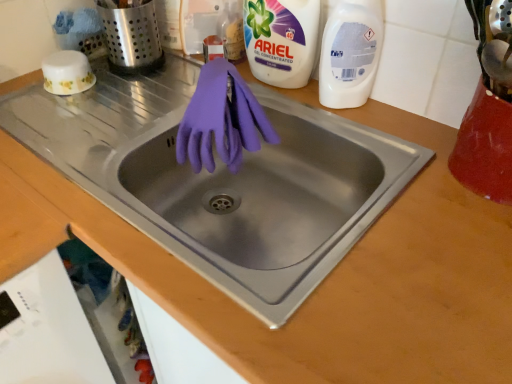
Where is `white gel concentrated at upper right, arranged as the 2th cleaning product when viewed from the right`? The height and width of the screenshot is (384, 512). white gel concentrated at upper right, arranged as the 2th cleaning product when viewed from the right is located at coordinates (281, 40).

Describe the element at coordinates (131, 35) in the screenshot. I see `brushed metal utensil holder at upper left` at that location.

The image size is (512, 384). In order to click on white plastic bottle at upper right, marked as the first cleaning product in a right-to-left arrangement in this screenshot , I will do `click(350, 53)`.

The height and width of the screenshot is (384, 512). What do you see at coordinates (256, 195) in the screenshot?
I see `matte purple gloves at center` at bounding box center [256, 195].

The width and height of the screenshot is (512, 384). In order to click on white plastic dishwasher at lower left in this screenshot , I will do `click(49, 330)`.

In order to face purple rubber gloves at center, should I rotate leftwards or rightwards?

To align with it, rotate left about 3.256°.

This screenshot has width=512, height=384. In order to click on white gel concentrated at upper right, which ranks as the first cleaning product in left-to-right order in this screenshot , I will do `click(281, 40)`.

Visually, is matte purple gloves at center positioned to the left or to the right of white gel concentrated at upper right, arranged as the 2th cleaning product when viewed from the right?

Based on their positions, matte purple gloves at center is located to the left of white gel concentrated at upper right, arranged as the 2th cleaning product when viewed from the right.

Where is `the 2nd cleaning product above when counting from the matte purple gloves at center (from the image's perspective)`? the 2nd cleaning product above when counting from the matte purple gloves at center (from the image's perspective) is located at coordinates (281, 40).

Is matte purple gloves at center facing away from white gel concentrated at upper right, arranged as the 2th cleaning product when viewed from the right?

No, matte purple gloves at center is not facing the opposite direction of white gel concentrated at upper right, arranged as the 2th cleaning product when viewed from the right.

Is white plastic bottle at upper right, which is the second cleaning product from left to right, far away from matte purple gloves at center?

No, there isn't a large distance between white plastic bottle at upper right, which is the second cleaning product from left to right, and matte purple gloves at center.

From a real-world perspective, does white plastic bottle at upper right, which is the second cleaning product from left to right, sit lower than matte purple gloves at center?

No.

Is white plastic bottle at upper right, marked as the first cleaning product in a right-to-left arrangement, oriented away from matte purple gloves at center?

white plastic bottle at upper right, marked as the first cleaning product in a right-to-left arrangement, is not turned away from matte purple gloves at center.

Considering the positions of point (77, 381) and point (357, 79), is point (77, 381) closer or farther from the camera than point (357, 79)?

Point (77, 381) is positioned closer to the camera compared to point (357, 79).

Is white plastic dishwasher at lower left to the left of white plastic bottle at upper right, marked as the first cleaning product in a right-to-left arrangement, from the viewer's perspective?

Correct, you'll find white plastic dishwasher at lower left to the left of white plastic bottle at upper right, marked as the first cleaning product in a right-to-left arrangement.

From a real-world perspective, is white plastic dishwasher at lower left physically located above or below white plastic bottle at upper right, which is the second cleaning product from left to right?

From a real-world perspective, white plastic dishwasher at lower left is physically below white plastic bottle at upper right, which is the second cleaning product from left to right.

Between white plastic dishwasher at lower left and white plastic bottle at upper right, marked as the first cleaning product in a right-to-left arrangement, which one has larger width?

white plastic dishwasher at lower left.

From a real-world perspective, who is located lower, purple rubber gloves at center or matte purple gloves at center?

matte purple gloves at center is physically lower.

Which of these two, purple rubber gloves at center or matte purple gloves at center, is smaller?

Smaller between the two is purple rubber gloves at center.

Does purple rubber gloves at center touch matte purple gloves at center?

No, purple rubber gloves at center is not beside matte purple gloves at center.

Considering the relative positions of matte purple gloves at center and brushed metal utensil holder at upper left in the image provided, is matte purple gloves at center behind brushed metal utensil holder at upper left?

No, matte purple gloves at center is closer to the camera.

Is matte purple gloves at center with brushed metal utensil holder at upper left?

No, matte purple gloves at center is not beside brushed metal utensil holder at upper left.

Between matte purple gloves at center and brushed metal utensil holder at upper left, which one appears on the left side from the viewer's perspective?

Positioned to the left is brushed metal utensil holder at upper left.

At what (x,y) coordinates should I click in order to perform the action: click on sink on the right side of brushed metal utensil holder at upper left. Please return your answer as a coordinate pair (x, y). Looking at the image, I should click on (256, 195).

From a real-world perspective, between white plastic bottle at upper right, which is the second cleaning product from left to right, and purple rubber gloves at center, who is vertically lower?

From a 3D spatial view, purple rubber gloves at center is below.

Between point (332, 53) and point (205, 112), which one is positioned in front?

The point (205, 112) is closer to the camera.

Between white plastic bottle at upper right, marked as the first cleaning product in a right-to-left arrangement, and purple rubber gloves at center, which one has smaller size?

With smaller size is white plastic bottle at upper right, marked as the first cleaning product in a right-to-left arrangement.

How much distance is there between white plastic bottle at upper right, which is the second cleaning product from left to right, and purple rubber gloves at center?

white plastic bottle at upper right, which is the second cleaning product from left to right, is 8.82 inches from purple rubber gloves at center.

Is purple rubber gloves at center not within white gel concentrated at upper right, which ranks as the first cleaning product in left-to-right order?

That's correct, purple rubber gloves at center is outside of white gel concentrated at upper right, which ranks as the first cleaning product in left-to-right order.

Between purple rubber gloves at center and white gel concentrated at upper right, arranged as the 2th cleaning product when viewed from the right, which one is positioned in front?

purple rubber gloves at center is more forward.

Looking at the image, does purple rubber gloves at center seem bigger or smaller compared to white gel concentrated at upper right, which ranks as the first cleaning product in left-to-right order?

Clearly, purple rubber gloves at center is smaller in size than white gel concentrated at upper right, which ranks as the first cleaning product in left-to-right order.

How different are the orientations of purple rubber gloves at center and white gel concentrated at upper right, arranged as the 2th cleaning product when viewed from the right, in degrees?

purple rubber gloves at center and white gel concentrated at upper right, arranged as the 2th cleaning product when viewed from the right, are facing 0.00072 degrees away from each other.

Find the location of a particular element. The width and height of the screenshot is (512, 384). sink below the white gel concentrated at upper right, which ranks as the first cleaning product in left-to-right order (from the image's perspective) is located at coordinates coord(256,195).

Locate an element on the screen. sink on the left of white plastic bottle at upper right, marked as the first cleaning product in a right-to-left arrangement is located at coordinates (256, 195).

Looking at the image, which one is located further to white plastic bottle at upper right, marked as the first cleaning product in a right-to-left arrangement, purple rubber gloves at center or white plastic dishwasher at lower left?

Among the two, white plastic dishwasher at lower left is located further to white plastic bottle at upper right, marked as the first cleaning product in a right-to-left arrangement.

Considering their positions, is white plastic dishwasher at lower left positioned closer to matte purple gloves at center than brushed metal utensil holder at upper left?

white plastic dishwasher at lower left is closer to matte purple gloves at center.

Considering their positions, is purple rubber gloves at center positioned further to white gel concentrated at upper right, arranged as the 2th cleaning product when viewed from the right, than white plastic dishwasher at lower left?

white plastic dishwasher at lower left is positioned further to the anchor white gel concentrated at upper right, arranged as the 2th cleaning product when viewed from the right.

Considering their positions, is matte purple gloves at center positioned further to white plastic bottle at upper right, which is the second cleaning product from left to right, than white plastic dishwasher at lower left?

Based on the image, white plastic dishwasher at lower left appears to be further to white plastic bottle at upper right, which is the second cleaning product from left to right.

Which object lies further to the anchor point white plastic dishwasher at lower left, white plastic bottle at upper right, marked as the first cleaning product in a right-to-left arrangement, or purple rubber gloves at center?

The object further to white plastic dishwasher at lower left is white plastic bottle at upper right, marked as the first cleaning product in a right-to-left arrangement.

Based on their spatial positions, is brushed metal utensil holder at upper left or white plastic bottle at upper right, which is the second cleaning product from left to right, further from matte purple gloves at center?

brushed metal utensil holder at upper left.

Which object lies further to the anchor point brushed metal utensil holder at upper left, white gel concentrated at upper right, arranged as the 2th cleaning product when viewed from the right, or white plastic dishwasher at lower left?

white plastic dishwasher at lower left lies further to brushed metal utensil holder at upper left than the other object.

Looking at the image, which one is located further to white plastic bottle at upper right, marked as the first cleaning product in a right-to-left arrangement, white gel concentrated at upper right, which ranks as the first cleaning product in left-to-right order, or brushed metal utensil holder at upper left?

The object further to white plastic bottle at upper right, marked as the first cleaning product in a right-to-left arrangement, is brushed metal utensil holder at upper left.

At what (x,y) coordinates should I click in order to perform the action: click on glove between white gel concentrated at upper right, arranged as the 2th cleaning product when viewed from the right, and matte purple gloves at center, in the vertical direction. Please return your answer as a coordinate pair (x, y). The image size is (512, 384). Looking at the image, I should click on (221, 120).

Image resolution: width=512 pixels, height=384 pixels. Find the location of `cleaning product between brushed metal utensil holder at upper left and white plastic dishwasher at lower left vertically`. cleaning product between brushed metal utensil holder at upper left and white plastic dishwasher at lower left vertically is located at coordinates (350, 53).

Where is `appliance between white gel concentrated at upper right, arranged as the 2th cleaning product when viewed from the right, and white plastic dishwasher at lower left, in the vertical direction`? This screenshot has width=512, height=384. appliance between white gel concentrated at upper right, arranged as the 2th cleaning product when viewed from the right, and white plastic dishwasher at lower left, in the vertical direction is located at coordinates (131, 35).

Find the location of `glove located between matte purple gloves at center and white plastic bottle at upper right, marked as the first cleaning product in a right-to-left arrangement, in the left-right direction`. glove located between matte purple gloves at center and white plastic bottle at upper right, marked as the first cleaning product in a right-to-left arrangement, in the left-right direction is located at coordinates (221, 120).